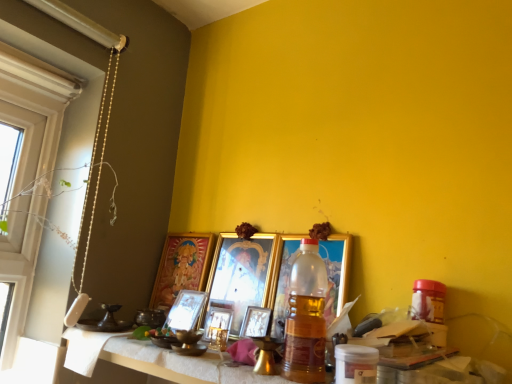
Question: Can you confirm if white textured table at lower center is shorter than gold metallic picture frame at center, the third picture frame viewed from the right?

Choices:
 (A) no
 (B) yes

Answer: (B)

Question: From a real-world perspective, is white textured table at lower center beneath gold metallic picture frame at center, the third picture frame viewed from the right?

Choices:
 (A) yes
 (B) no

Answer: (A)

Question: Is white textured table at lower center oriented away from gold metallic picture frame at center, which appears as the fourth picture frame when viewed from the left?

Choices:
 (A) yes
 (B) no

Answer: (B)

Question: Is white textured table at lower center completely or partially outside of gold metallic picture frame at center, which appears as the fourth picture frame when viewed from the left?

Choices:
 (A) yes
 (B) no

Answer: (A)

Question: Does white textured table at lower center have a greater width compared to gold metallic picture frame at center, which appears as the fourth picture frame when viewed from the left?

Choices:
 (A) yes
 (B) no

Answer: (A)

Question: Is pearl-like beads at left spatially inside translucent plastic bottle at center, or outside of it?

Choices:
 (A) outside
 (B) inside

Answer: (A)

Question: Does point (x=114, y=71) appear closer or farther from the camera than point (x=318, y=309)?

Choices:
 (A) farther
 (B) closer

Answer: (A)

Question: Relative to translucent plastic bottle at center, is pearl-like beads at left in front or behind?

Choices:
 (A) behind
 (B) front

Answer: (A)

Question: Looking at their shapes, would you say pearl-like beads at left is wider or thinner than translucent plastic bottle at center?

Choices:
 (A) thin
 (B) wide

Answer: (A)

Question: Is gold metallic picture frame at center, marked as the 6th picture frame in a left-to-right arrangement, spatially inside white textured table at lower center, or outside of it?

Choices:
 (A) outside
 (B) inside

Answer: (A)

Question: Relative to white textured table at lower center, is gold metallic picture frame at center, marked as the 6th picture frame in a left-to-right arrangement, in front or behind?

Choices:
 (A) behind
 (B) front

Answer: (A)

Question: Based on their sizes in the image, would you say gold metallic picture frame at center, marked as the 6th picture frame in a left-to-right arrangement, is bigger or smaller than white textured table at lower center?

Choices:
 (A) big
 (B) small

Answer: (B)

Question: Is point (276, 326) closer or farther from the camera than point (118, 337)?

Choices:
 (A) farther
 (B) closer

Answer: (B)

Question: Is point (256, 314) positioned closer to the camera than point (202, 337)?

Choices:
 (A) closer
 (B) farther

Answer: (B)

Question: Considering their positions, is metallic gold picture frame at center, arranged as the 5th picture frame when viewed from the left, located in front of or behind metallic gold picture frame at center, placed as the third picture frame when sorted from left to right?

Choices:
 (A) front
 (B) behind

Answer: (A)